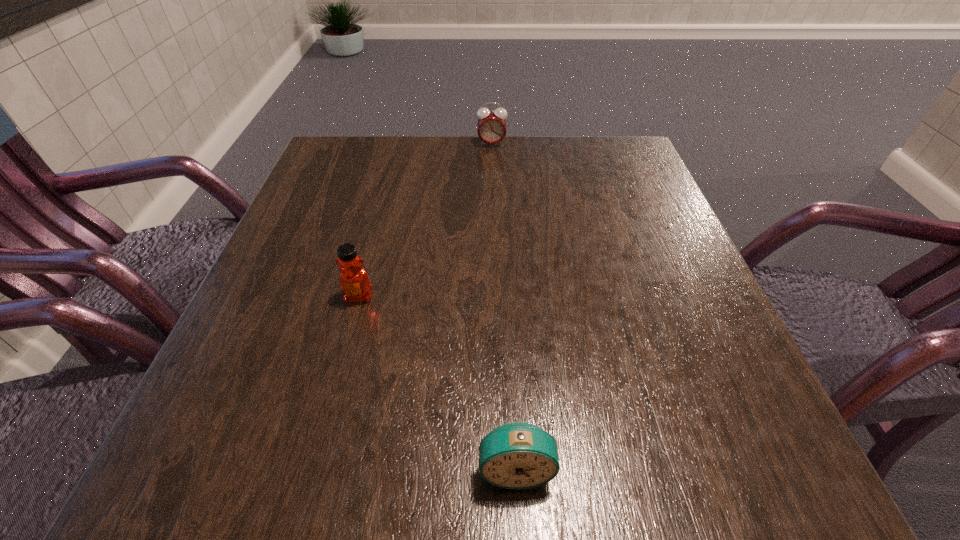
The image size is (960, 540). Find the location of `the farther alarm clock`. the farther alarm clock is located at coordinates (491, 125).

Find the location of `the second farthest object`. the second farthest object is located at coordinates (354, 281).

Image resolution: width=960 pixels, height=540 pixels. Find the location of `honey`. honey is located at coordinates (354, 281).

The height and width of the screenshot is (540, 960). I want to click on the nearer alarm clock, so click(x=517, y=455).

Locate an element on the screen. The image size is (960, 540). free space located 0.170m on the clock face of the farthest object is located at coordinates (492, 186).

The image size is (960, 540). Find the location of `free location located on the front label of the second farthest object`. free location located on the front label of the second farthest object is located at coordinates (324, 427).

You are a GUI agent. You are given a task and a screenshot of the screen. Output one action in this format:
    pyautogui.click(x=<x>, y=<y>)
    Task: Click on the object positioned at the far edge
    The width and height of the screenshot is (960, 540).
    Given the screenshot: What is the action you would take?
    pyautogui.click(x=491, y=125)

Identify the location of object that is at the near edge. (517, 455).

Locate an element on the screen. object that is at the left edge is located at coordinates (354, 281).

This screenshot has width=960, height=540. What are the coordinates of `free space at the far edge of the desktop` in the screenshot? It's located at (391, 176).